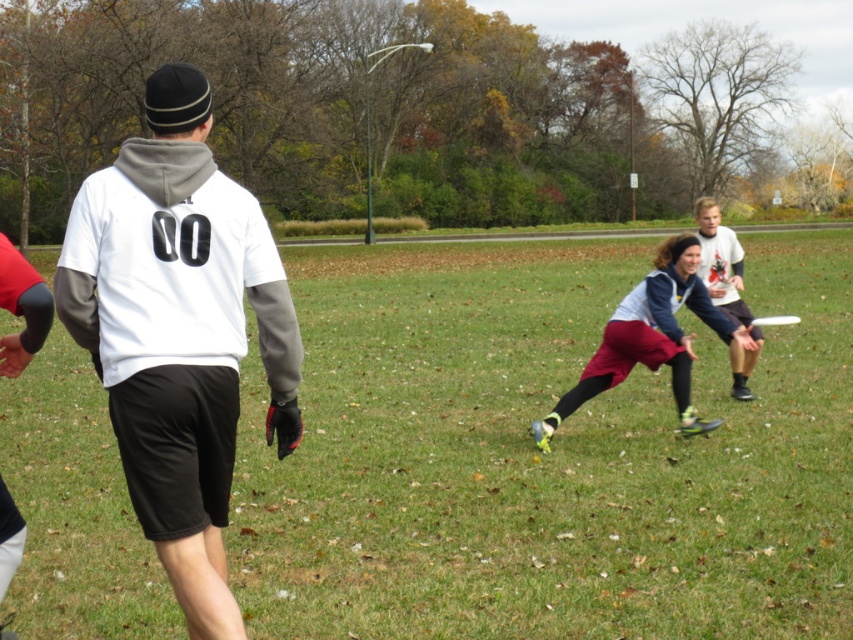
Question: Does white matte hoodie at center lie in front of white jersey at center?

Choices:
 (A) yes
 (B) no

Answer: (A)

Question: Which of these objects is positioned farthest from the maroon fabric pants at center?

Choices:
 (A) white plastic frisbee at center
 (B) white matte hoodie at center

Answer: (B)

Question: Does white jersey at center appear on the left side of white plastic frisbee at center?

Choices:
 (A) no
 (B) yes

Answer: (B)

Question: Which point is farther to the camera?

Choices:
 (A) (779, 316)
 (B) (181, 163)

Answer: (A)

Question: Which is farther from the green grass at center?

Choices:
 (A) maroon fabric pants at center
 (B) white matte hoodie at center
 (C) white plastic frisbee at center

Answer: (B)

Question: Is maroon fabric pants at center positioned in front of white jersey at center?

Choices:
 (A) yes
 (B) no

Answer: (A)